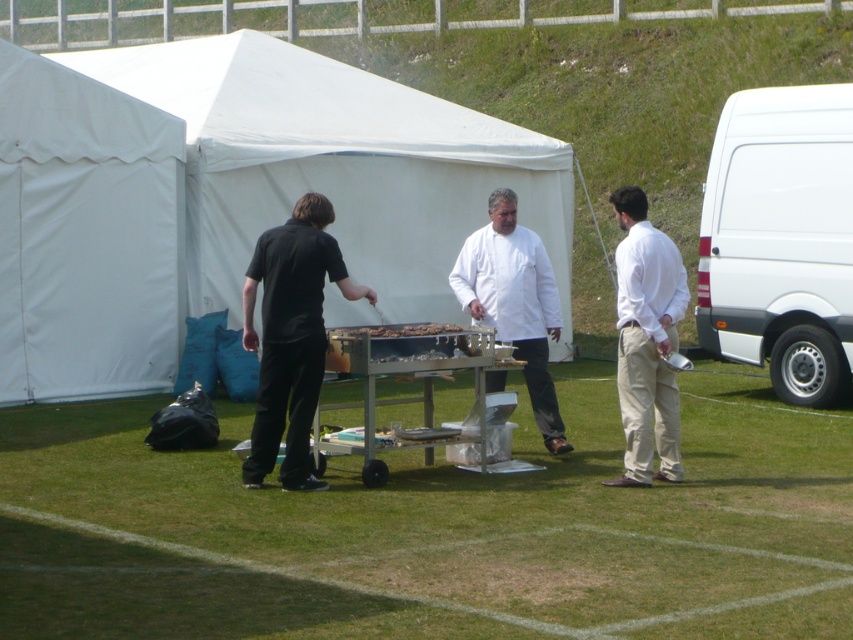
Question: Can you confirm if white matte van at right is bigger than smooth wooden cutting board at center?

Choices:
 (A) no
 (B) yes

Answer: (B)

Question: Does black matte shirt at center have a lesser width compared to white cotton shirt at right?

Choices:
 (A) yes
 (B) no

Answer: (B)

Question: Which point is farther to the camera?

Choices:
 (A) smooth wooden cutting board at center
 (B) white cotton shirt at right

Answer: (B)

Question: Which point is closer to the camera taking this photo?

Choices:
 (A) (799, 365)
 (B) (646, 227)

Answer: (B)

Question: Is white matte van at right above smooth wooden cutting board at center?

Choices:
 (A) no
 (B) yes

Answer: (B)

Question: Among these objects, which one is farthest from the camera?

Choices:
 (A) smooth wooden cutting board at center
 (B) white cotton shirt at right
 (C) black matte shirt at center
 (D) white matte van at right

Answer: (D)